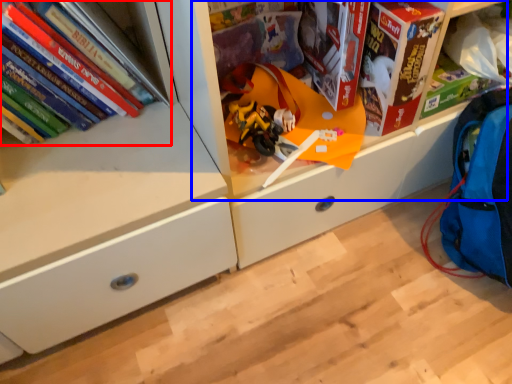
Question: Which object is further to the camera taking this photo, book (highlighted by a red box) or shelf (highlighted by a blue box)?

Choices:
 (A) book
 (B) shelf

Answer: (A)